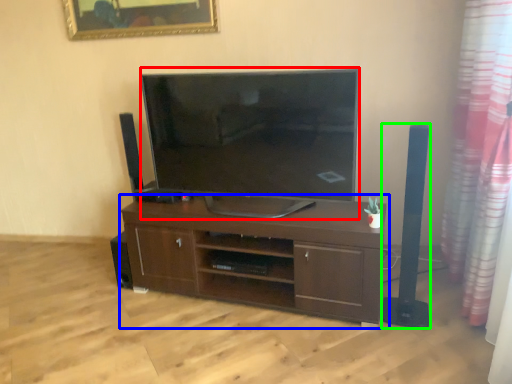
Question: Based on their relative distances, which object is farther from television (highlighted by a red box)? Choose from cabinetry (highlighted by a blue box) and speaker (highlighted by a green box).

Choices:
 (A) cabinetry
 (B) speaker

Answer: (B)